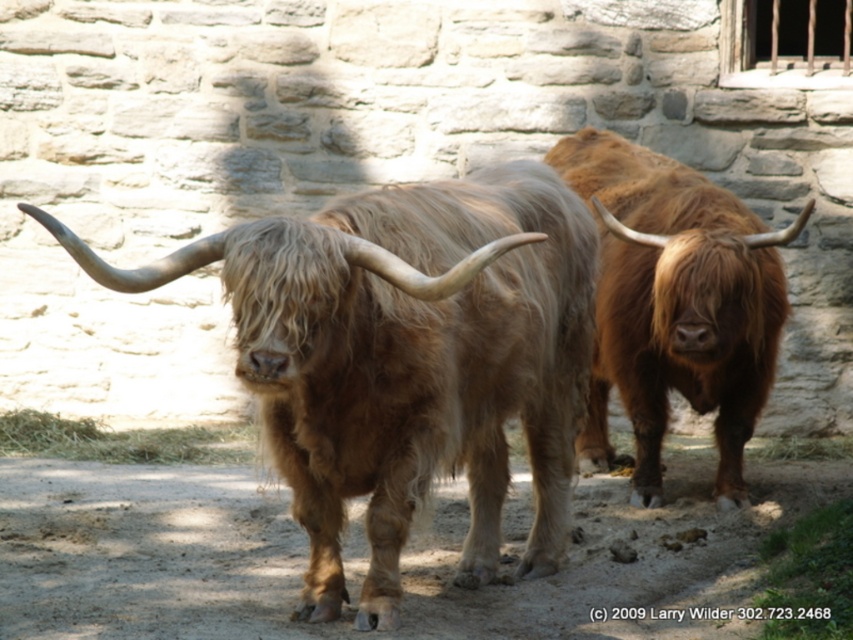
Question: Among these objects, which one is nearest to the camera?

Choices:
 (A) brown fuzzy bull at center
 (B) fuzzy brown yak at center

Answer: (B)

Question: Where is fuzzy brown yak at center located in relation to brown fuzzy bull at center in the image?

Choices:
 (A) left
 (B) right

Answer: (A)

Question: Does fuzzy brown yak at center lie in front of brown fuzzy bull at center?

Choices:
 (A) no
 (B) yes

Answer: (B)

Question: Is fuzzy brown yak at center to the right of brown fuzzy bull at center from the viewer's perspective?

Choices:
 (A) no
 (B) yes

Answer: (A)

Question: Which object is closer to the camera taking this photo?

Choices:
 (A) brown fuzzy bull at center
 (B) fuzzy brown yak at center

Answer: (B)